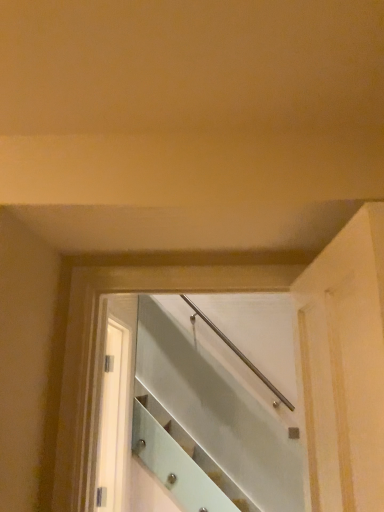
This screenshot has height=512, width=384. What do you see at coordinates (114, 421) in the screenshot? I see `white glossy screen door at center` at bounding box center [114, 421].

Locate an element on the screen. Image resolution: width=384 pixels, height=512 pixels. white glossy screen door at center is located at coordinates (114, 421).

Image resolution: width=384 pixels, height=512 pixels. I want to click on white glossy screen door at center, so click(x=114, y=421).